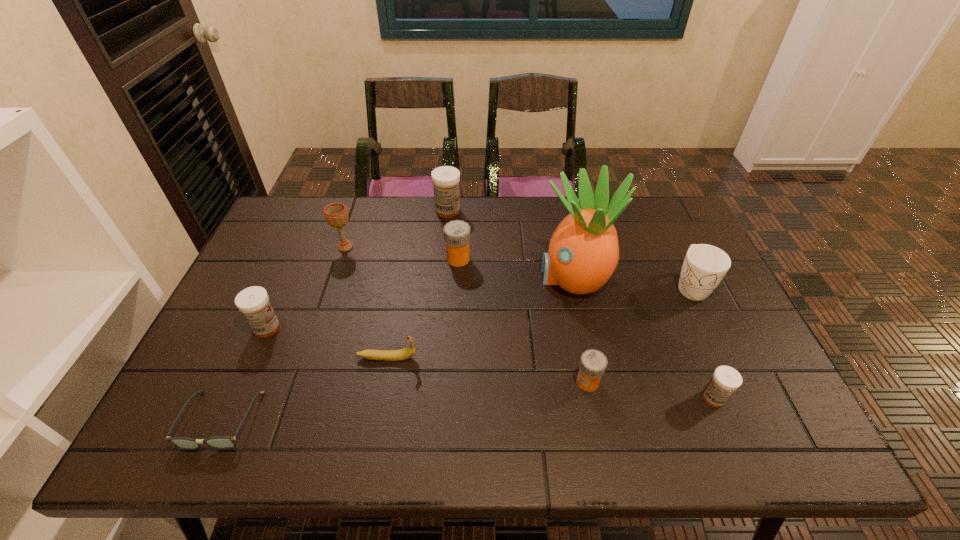
Where is `the third nearest medicine`? the third nearest medicine is located at coordinates (253, 302).

You are a GUI agent. You are given a task and a screenshot of the screen. Output one action in this format:
    pyautogui.click(x=<x>, y=<y>)
    Task: Click on the yellow banana
    The height and width of the screenshot is (540, 960).
    Given the screenshot: What is the action you would take?
    pyautogui.click(x=387, y=355)

This screenshot has height=540, width=960. Find the location of `the seventh farthest object`. the seventh farthest object is located at coordinates (387, 355).

What are the coordinates of `the nearer orange medicine` in the screenshot? It's located at (593, 363).

Locate an element on the screen. The image size is (960, 540). the fourth medicine from left to right is located at coordinates (593, 363).

Where is `the rightmost medicine`? This screenshot has height=540, width=960. the rightmost medicine is located at coordinates (x=726, y=380).

This screenshot has height=540, width=960. I want to click on the nearest white medicine, so click(x=726, y=380).

Locate an element on the screen. The image size is (960, 540). gray spectacles is located at coordinates (217, 442).

At what (x,y) coordinates should I click in order to perform the action: click on the shortest object. Please return your answer as a coordinate pair (x, y). The width and height of the screenshot is (960, 540). Looking at the image, I should click on (217, 442).

Find the location of a particular element. free space located 0.230m at the entrance of the tallest object is located at coordinates (458, 277).